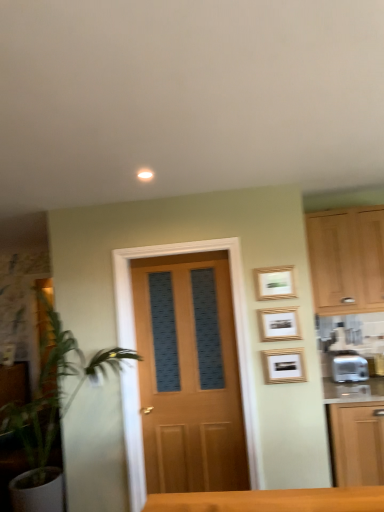
Question: Considering the positions of gold-framed picture at upper right, the first picture frame from the top, and light wood cabinet at right, the 1th cabinetry viewed from the top, in the image, is gold-framed picture at upper right, the first picture frame from the top, taller or shorter than light wood cabinet at right, the 1th cabinetry viewed from the top,?

Choices:
 (A) tall
 (B) short

Answer: (B)

Question: From the image's perspective, is gold-framed picture at upper right, the first picture frame from the top, located above or below light wood cabinet at right, acting as the first cabinetry starting from the front?

Choices:
 (A) below
 (B) above

Answer: (A)

Question: Estimate the real-world distances between objects in this image. Which object is closer to the gold-framed picture at upper right, arranged as the second picture frame when ordered from the bottom?

Choices:
 (A) gold-framed picture at center-right, the 1th picture frame from the bottom
 (B) light wood cabinet at right, positioned as the second cabinetry in back-to-front order
 (C) wooden door at center
 (D) green leafy plant at left
 (E) silver metallic toaster at right

Answer: (A)

Question: Which is nearer to the green leafy plant at left?

Choices:
 (A) silver metallic toaster at right
 (B) matte wood cabinet at left, the 2th cabinetry from the top
 (C) gold-framed picture at upper right, the first picture frame from the top
 (D) gold-framed picture at upper right, arranged as the second picture frame when ordered from the bottom
 (E) wooden door at center

Answer: (B)